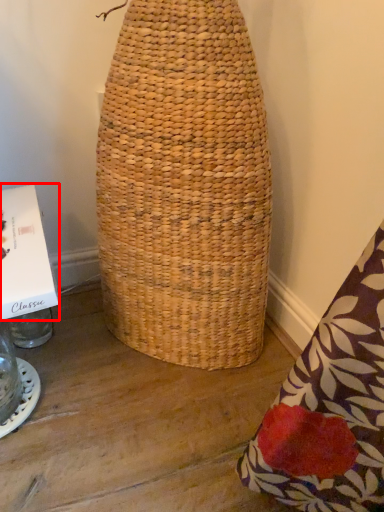
Question: Observing the image, what is the correct spatial positioning of cardboard box (annotated by the red box) in reference to glass jar?

Choices:
 (A) right
 (B) left

Answer: (A)